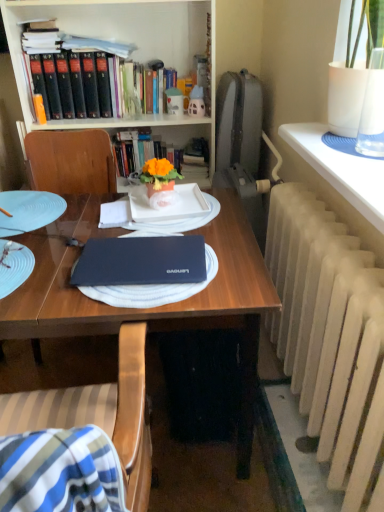
Find the location of a particular element. The height and width of the screenshot is (512, 384). empty space that is ontop of matte black laptop at center is located at coordinates (144, 236).